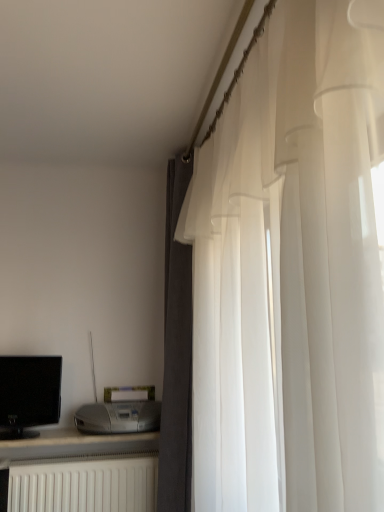
Locate an element on the screen. vacant space in black glossy computer monitor at left (from a real-world perspective) is located at coordinates (23, 439).